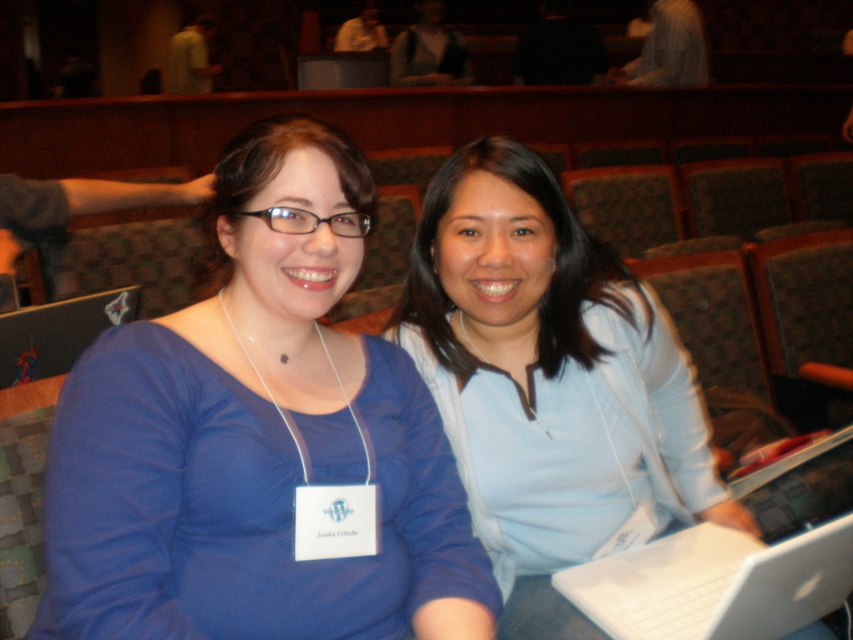
Question: Which of these objects is positioned closest to the white plastic laptop at center?

Choices:
 (A) matte black laptop at left
 (B) light blue fabric shirt at center

Answer: (B)

Question: Is light blue fabric shirt at center above matte black laptop at left?

Choices:
 (A) yes
 (B) no

Answer: (B)

Question: Can you confirm if light blue fabric shirt at center is positioned to the right of matte black laptop at left?

Choices:
 (A) no
 (B) yes

Answer: (B)

Question: Which point is closer to the camera taking this photo?

Choices:
 (A) (695, 604)
 (B) (27, 634)

Answer: (B)

Question: Can you confirm if matte blue shirt at center is thinner than white plastic laptop at center?

Choices:
 (A) yes
 (B) no

Answer: (A)

Question: Which object is the closest to the matte black laptop at left?

Choices:
 (A) white plastic laptop at center
 (B) light blue fabric shirt at center
 (C) matte blue shirt at center

Answer: (C)